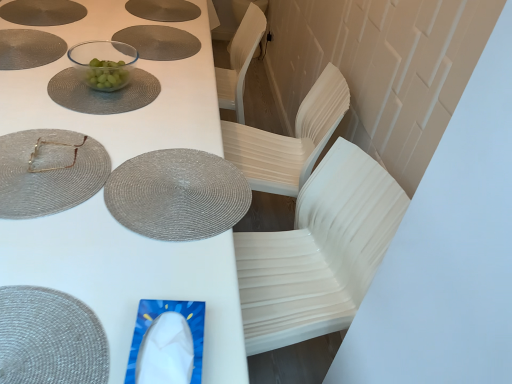
This screenshot has height=384, width=512. What are the coordinates of `vacant space underneath transparent glass bowl at upper center, the 1th glass plate positioned from the top (from a real-world perspective)` in the screenshot? It's located at (108, 89).